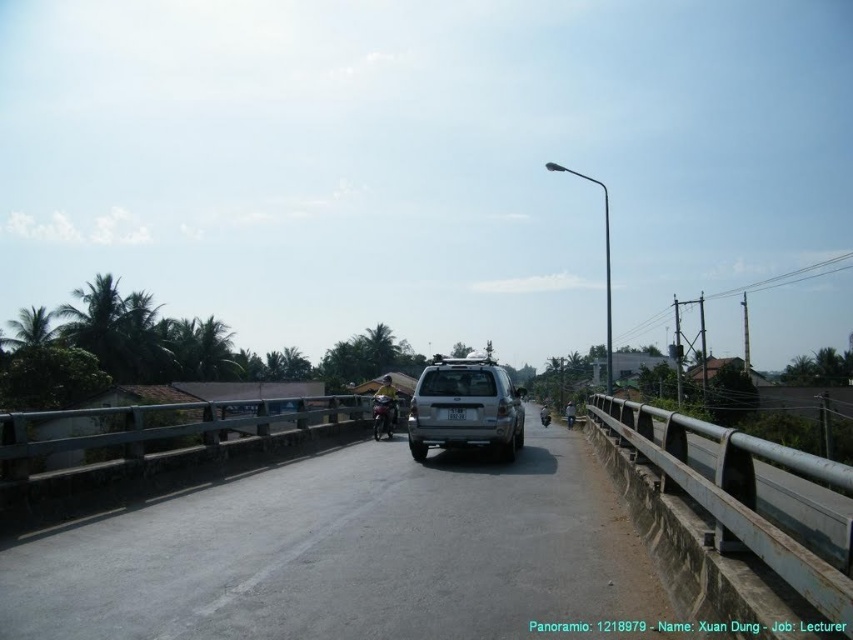
Question: Among these points, which one is farthest from the camera?

Choices:
 (A) (387, 435)
 (B) (26, 422)

Answer: (A)

Question: Does gray concrete highway at center come in front of metallic gray rail at right?

Choices:
 (A) yes
 (B) no

Answer: (B)

Question: Does gray concrete highway at center appear on the right side of metallic gray rail at right?

Choices:
 (A) yes
 (B) no

Answer: (B)

Question: Based on their relative distances, which object is nearer to the silver metallic suv at center?

Choices:
 (A) metallic gray rail at right
 (B) metallic silver motorcycle at center
 (C) metallic gray rail at center
 (D) gray concrete highway at center

Answer: (D)

Question: Which point is closer to the camera taking this photo?

Choices:
 (A) (372, 426)
 (B) (627, 428)
 (C) (293, 465)

Answer: (B)

Question: Can you confirm if gray concrete highway at center is smaller than metallic silver motorcycle at center?

Choices:
 (A) yes
 (B) no

Answer: (B)